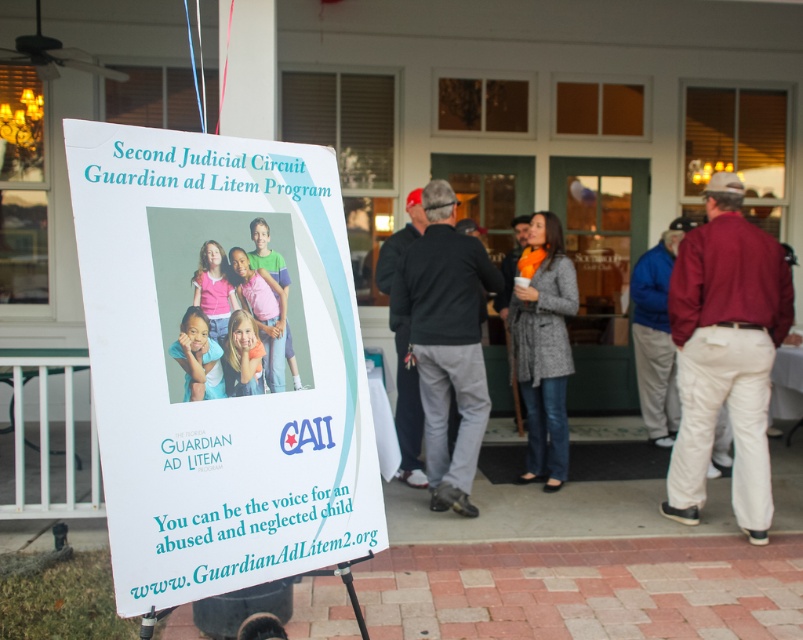
Is the position of blonde hair girl at center less distant than that of multicolored t-shirt at center?

That is True.

Based on the photo, can you confirm if blonde hair girl at center is positioned to the left of multicolored t-shirt at center?

Indeed, blonde hair girl at center is positioned on the left side of multicolored t-shirt at center.

This screenshot has width=803, height=640. Describe the element at coordinates (243, 355) in the screenshot. I see `blonde hair girl at center` at that location.

Identify the location of blonde hair girl at center. (243, 355).

Can you confirm if maroon shirt at right is bigger than black sweater at center?

Incorrect, maroon shirt at right is not larger than black sweater at center.

The image size is (803, 640). What do you see at coordinates (724, 353) in the screenshot? I see `maroon shirt at right` at bounding box center [724, 353].

The width and height of the screenshot is (803, 640). I want to click on maroon shirt at right, so click(x=724, y=353).

Which is more to the left, maroon shirt at right or gray wool coat at center?

gray wool coat at center is more to the left.

Can you confirm if maroon shirt at right is taller than gray wool coat at center?

Yes, maroon shirt at right is taller than gray wool coat at center.

Is point (685, 333) closer to viewer compared to point (520, 259)?

Yes, point (685, 333) is in front of point (520, 259).

You are a GUI agent. You are given a task and a screenshot of the screen. Output one action in this format:
    pyautogui.click(x=<x>, y=<y>)
    Task: Click on the maroon shirt at right
    The width and height of the screenshot is (803, 640).
    Given the screenshot: What is the action you would take?
    pyautogui.click(x=724, y=353)